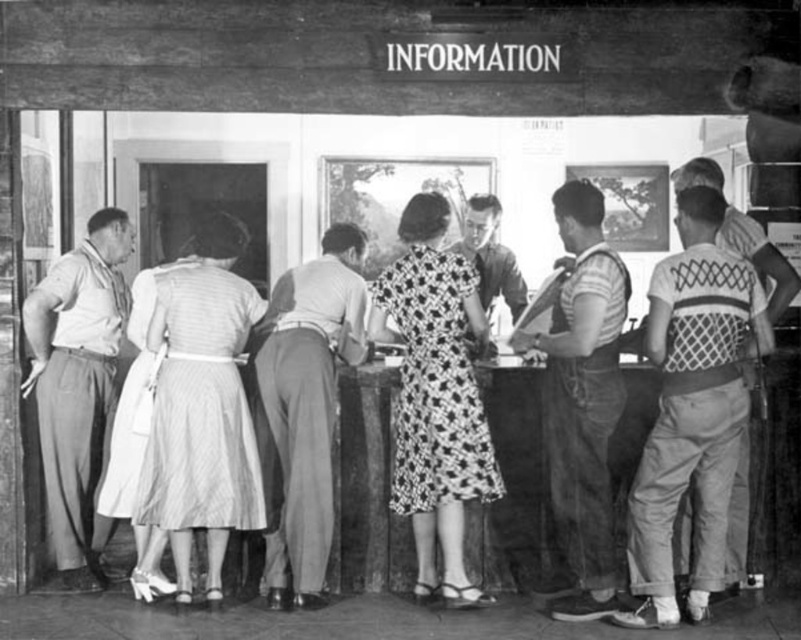
Question: Which object appears farthest from the camera in this image?

Choices:
 (A) printed fabric dress at center
 (B) denim overalls at center
 (C) knitted sweater at right
 (D) light gray cotton pants at center

Answer: (D)

Question: Does light gray cotton pants at center have a smaller size compared to smooth white shirt at left?

Choices:
 (A) no
 (B) yes

Answer: (A)

Question: In this image, where is striped fabric dress at center located relative to smooth white shirt at left?

Choices:
 (A) left
 (B) right

Answer: (B)

Question: Does printed fabric dress at center have a smaller size compared to denim overalls at center?

Choices:
 (A) no
 (B) yes

Answer: (B)

Question: Which of the following is the farthest from the observer?

Choices:
 (A) (433, 506)
 (B) (481, 196)

Answer: (B)

Question: Estimate the real-world distances between objects in this image. Which object is farther from the striped fabric dress at center?

Choices:
 (A) printed fabric dress at center
 (B) smooth white shirt at left

Answer: (A)